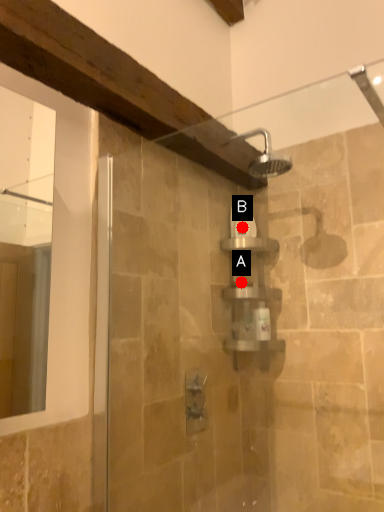
Question: Two points are circled on the image, labeled by A and B beside each circle. Among these points, which one is nearest to the camera?

Choices:
 (A) A is closer
 (B) B is closer

Answer: (A)